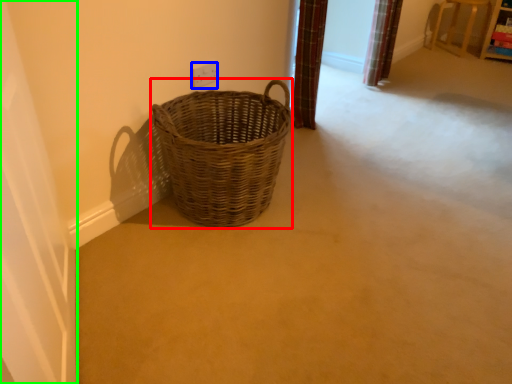
Question: Which object is the closest to the picnic basket (highlighted by a red box)? Choose among these: electric outlet (highlighted by a blue box) or screen door (highlighted by a green box).

Choices:
 (A) electric outlet
 (B) screen door

Answer: (A)